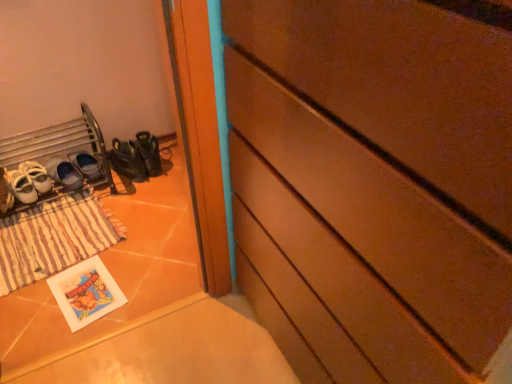
Locate an element on the screen. This screenshot has width=512, height=384. vacant area on top of brown striped mat at lower left (from a real-world perspective) is located at coordinates (51, 228).